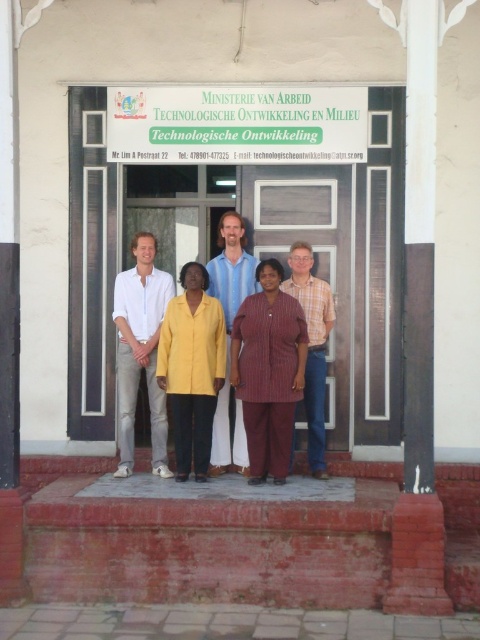
Does yellow cotton shirt at center come behind plaid fabric shirt at center?

Yes.

Is yellow cotton shirt at center to the left of plaid fabric shirt at center from the viewer's perspective?

Indeed, yellow cotton shirt at center is positioned on the left side of plaid fabric shirt at center.

Image resolution: width=480 pixels, height=640 pixels. What do you see at coordinates (131, 323) in the screenshot? I see `yellow cotton shirt at center` at bounding box center [131, 323].

Find the location of `yellow cotton shirt at center`. yellow cotton shirt at center is located at coordinates (131, 323).

Between yellow matte shirt at center and plaid fabric shirt at center, which one is positioned lower?

Positioned lower is yellow matte shirt at center.

Image resolution: width=480 pixels, height=640 pixels. I want to click on yellow matte shirt at center, so click(192, 369).

Find the location of a particular element. yellow matte shirt at center is located at coordinates (192, 369).

Can you confirm if maroon striped dress at center is thinner than yellow matte shirt at center?

No, maroon striped dress at center is not thinner than yellow matte shirt at center.

Which is in front, point (269, 291) or point (212, 419)?

Point (269, 291) is in front.

This screenshot has width=480, height=640. I want to click on maroon striped dress at center, so click(x=268, y=371).